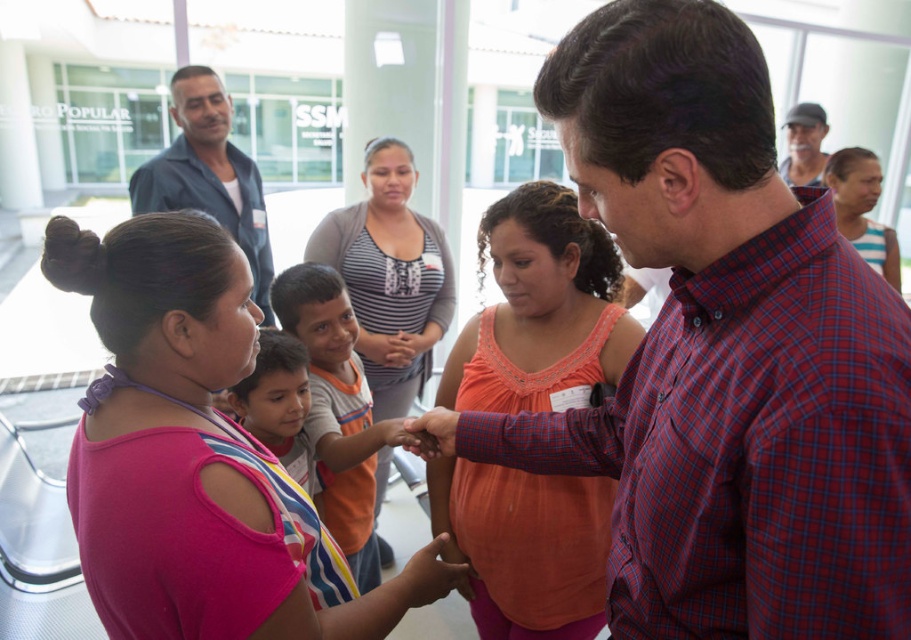
Between orange cotton tank top at center and orange cotton shirt at center, which one appears on the left side from the viewer's perspective?

orange cotton shirt at center

Can you confirm if orange cotton tank top at center is positioned to the right of orange cotton shirt at center?

Correct, you'll find orange cotton tank top at center to the right of orange cotton shirt at center.

Locate an element on the screen. The image size is (911, 640). orange cotton tank top at center is located at coordinates (540, 310).

You are a GUI agent. You are given a task and a screenshot of the screen. Output one action in this format:
    pyautogui.click(x=<x>, y=<y>)
    Task: Click on the orange cotton tank top at center
    The width and height of the screenshot is (911, 640).
    Given the screenshot: What is the action you would take?
    pyautogui.click(x=540, y=310)

Which is below, plaid shirt at center or striped fabric shirt at upper right?

Positioned lower is plaid shirt at center.

Which is more to the right, plaid shirt at center or striped fabric shirt at upper right?

From the viewer's perspective, striped fabric shirt at upper right appears more on the right side.

You are a GUI agent. You are given a task and a screenshot of the screen. Output one action in this format:
    pyautogui.click(x=<x>, y=<y>)
    Task: Click on the plaid shirt at center
    Image resolution: width=911 pixels, height=640 pixels.
    Given the screenshot: What is the action you would take?
    pyautogui.click(x=722, y=353)

Between pink fabric shirt at center and striped knit sweater at center, which one has less height?

pink fabric shirt at center

From the picture: Does pink fabric shirt at center have a smaller size compared to striped knit sweater at center?

Yes.

Does point (64, 266) come closer to viewer compared to point (386, 228)?

Yes, it is in front of point (386, 228).

The height and width of the screenshot is (640, 911). Find the location of `pink fabric shirt at center`. pink fabric shirt at center is located at coordinates (196, 456).